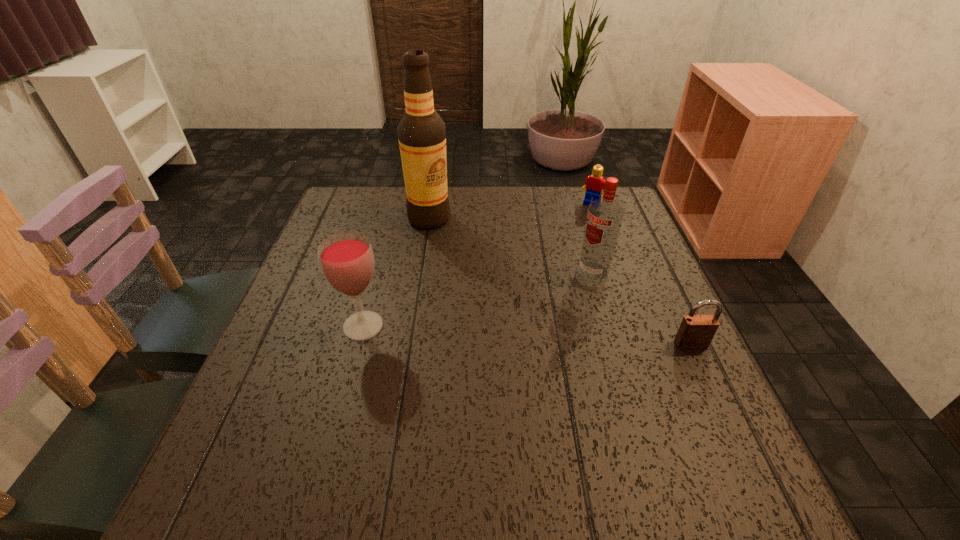
At what (x,y) coordinates should I click in order to perform the action: click on free space on the desktop that is between the third shortest object and the padlock and is positioned on the front label of the vodka. Please return your answer as a coordinate pair (x, y). This screenshot has height=540, width=960. Looking at the image, I should click on (506, 334).

Where is `free space on the desktop that is between the third shortest object and the padlock and is positioned on the front-facing side of the Lego`? free space on the desktop that is between the third shortest object and the padlock and is positioned on the front-facing side of the Lego is located at coordinates (493, 333).

At what (x,y) coordinates should I click in order to perform the action: click on vacant space on the desktop that is between the third shortest object and the padlock and is positioned on the label of the tallest object. Please return your answer as a coordinate pair (x, y). This screenshot has width=960, height=540. Looking at the image, I should click on (486, 333).